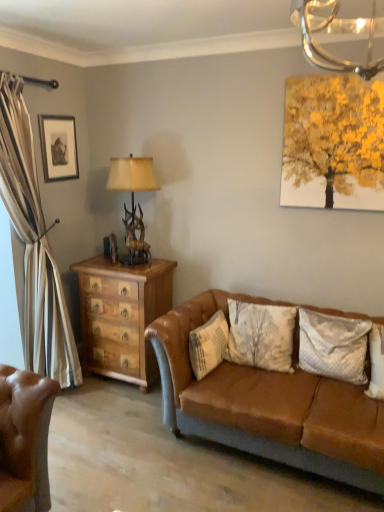
Question: Is velvety white pillow at center right, the 2th pillow when ordered from left to right, to the right of brown leather couch at center from the viewer's perspective?

Choices:
 (A) yes
 (B) no

Answer: (A)

Question: Is velvety white pillow at center right, the 1th pillow viewed from the right, further to the viewer compared to brown leather couch at center?

Choices:
 (A) yes
 (B) no

Answer: (A)

Question: Can you confirm if velvety white pillow at center right, the 2th pillow when ordered from left to right, is shorter than brown leather couch at center?

Choices:
 (A) no
 (B) yes

Answer: (B)

Question: Would you say velvety white pillow at center right, the 1th pillow viewed from the right, contains brown leather couch at center?

Choices:
 (A) yes
 (B) no

Answer: (B)

Question: From a real-world perspective, is velvety white pillow at center right, the 1th pillow viewed from the right, on top of brown leather couch at center?

Choices:
 (A) yes
 (B) no

Answer: (A)

Question: Is velvety white pillow at center right, the 2th pillow when ordered from left to right, bigger or smaller than brown leather couch at center?

Choices:
 (A) big
 (B) small

Answer: (B)

Question: Based on their positions, is velvety white pillow at center right, the 1th pillow viewed from the right, located to the left or right of brown leather couch at center?

Choices:
 (A) left
 (B) right

Answer: (B)

Question: From their relative heights in the image, would you say velvety white pillow at center right, the 1th pillow viewed from the right, is taller or shorter than brown leather couch at center?

Choices:
 (A) tall
 (B) short

Answer: (B)

Question: From the image's perspective, is velvety white pillow at center right, the 2th pillow when ordered from left to right, located above or below brown leather couch at center?

Choices:
 (A) below
 (B) above

Answer: (B)

Question: From a real-world perspective, is antler-patterned wood table lamp at left positioned above or below white textured pillow at center, which is the second pillow in right-to-left order?

Choices:
 (A) above
 (B) below

Answer: (A)

Question: Looking at their shapes, would you say antler-patterned wood table lamp at left is wider or thinner than white textured pillow at center, which appears as the 1th pillow when viewed from the left?

Choices:
 (A) wide
 (B) thin

Answer: (A)

Question: Would you say antler-patterned wood table lamp at left is to the left or to the right of white textured pillow at center, which appears as the 1th pillow when viewed from the left, in the picture?

Choices:
 (A) right
 (B) left

Answer: (B)

Question: From the image's perspective, is antler-patterned wood table lamp at left above or below white textured pillow at center, which appears as the 1th pillow when viewed from the left?

Choices:
 (A) below
 (B) above

Answer: (B)

Question: Relative to wooden chest of drawers at left, is brown leather couch at center in front or behind?

Choices:
 (A) behind
 (B) front

Answer: (B)

Question: Does point (306, 449) appear closer or farther from the camera than point (135, 291)?

Choices:
 (A) farther
 (B) closer

Answer: (B)